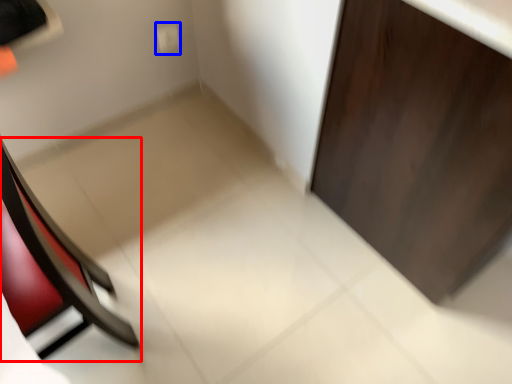
Question: Which point is closer to the camera, chair (highlighted by a red box) or electric outlet (highlighted by a blue box)?

Choices:
 (A) chair
 (B) electric outlet

Answer: (A)